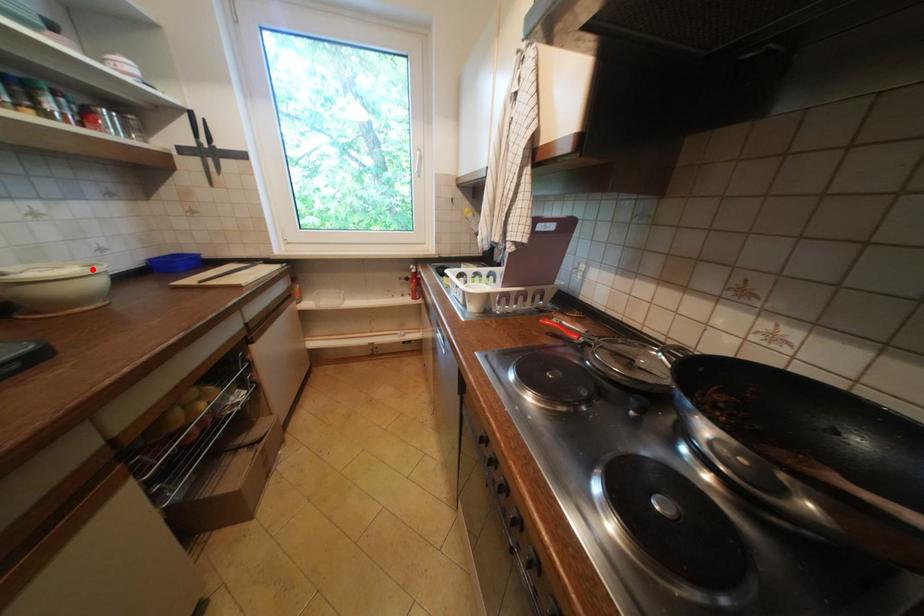
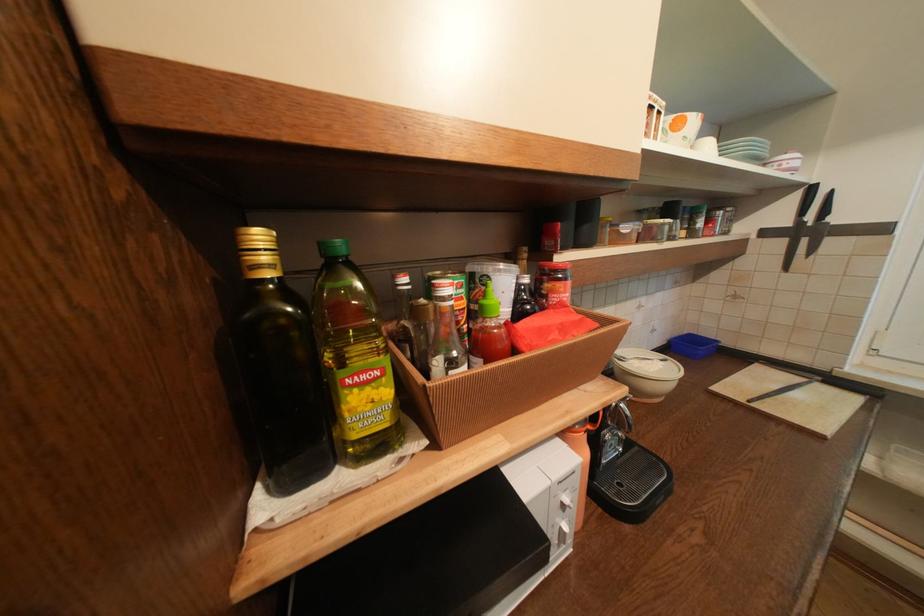
The point at the highlighted location is marked in the first image. Where is the corresponding point in the second image?

(670, 363)